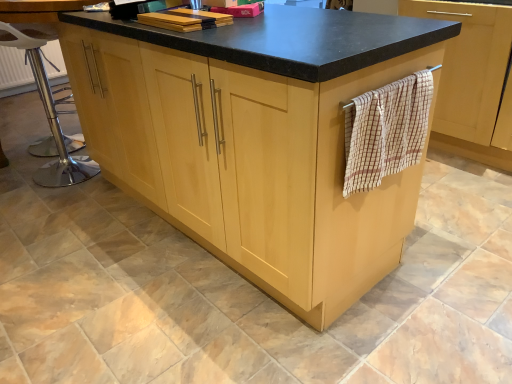
Image resolution: width=512 pixels, height=384 pixels. What do you see at coordinates (185, 19) in the screenshot?
I see `wooden cutting board at upper center` at bounding box center [185, 19].

The height and width of the screenshot is (384, 512). What are the coordinates of `beige checkered towel at right` in the screenshot? It's located at (386, 131).

The height and width of the screenshot is (384, 512). Describe the element at coordinates (256, 140) in the screenshot. I see `light wood cupboard at center` at that location.

Locate an element on the screen. This screenshot has height=384, width=512. polished chrome bar stool at left is located at coordinates (49, 117).

From a real-world perspective, which object rests below the other?

wooden towel rack at right, from a real-world perspective.

Is wooden towel rack at right oriented towards polished chrome bar stool at left?

No, wooden towel rack at right is not aimed at polished chrome bar stool at left.

Is the position of wooden towel rack at right less distant than that of polished chrome bar stool at left?

Yes, wooden towel rack at right is in front of polished chrome bar stool at left.

Find the location of a particular element. bar stool lying below the wooden towel rack at right (from the image's perspective) is located at coordinates (49, 117).

Is beige checkered towel at right completely or partially outside of wooden cutting board at upper center?

Yes, beige checkered towel at right is located beyond the bounds of wooden cutting board at upper center.

Considering the sizes of objects beige checkered towel at right and wooden cutting board at upper center in the image provided, who is shorter, beige checkered towel at right or wooden cutting board at upper center?

Standing shorter between the two is wooden cutting board at upper center.

Considering the points (391, 110) and (169, 17), which point is in front, point (391, 110) or point (169, 17)?

Point (391, 110)

Does wooden cutting board at upper center touch wooden towel rack at right?

There is a gap between wooden cutting board at upper center and wooden towel rack at right.

Is wooden cutting board at upper center to the left of wooden towel rack at right from the viewer's perspective?

Indeed, wooden cutting board at upper center is positioned on the left side of wooden towel rack at right.

Is point (172, 22) closer or farther from the camera than point (450, 106)?

Point (172, 22).

Is wooden cutting board at upper center wider than wooden towel rack at right?

No.

Is polished chrome bar stool at left not within beige checkered towel at right?

Absolutely, polished chrome bar stool at left is external to beige checkered towel at right.

Does polished chrome bar stool at left have a smaller size compared to beige checkered towel at right?

No.

From a real-world perspective, is polished chrome bar stool at left located higher than beige checkered towel at right?

No.

Would you say polished chrome bar stool at left is to the left or to the right of beige checkered towel at right in the picture?

Clearly, polished chrome bar stool at left is on the left of beige checkered towel at right in the image.

Find the location of a particular element. book on the right of the polished chrome bar stool at left is located at coordinates (185, 19).

Can you tell me how much polished chrome bar stool at left and wooden cutting board at upper center differ in facing direction?

67.7 degrees separate the facing orientations of polished chrome bar stool at left and wooden cutting board at upper center.

From the image's perspective, would you say polished chrome bar stool at left is positioned over wooden cutting board at upper center?

No, from the image's perspective, polished chrome bar stool at left is not above wooden cutting board at upper center.

Is polished chrome bar stool at left outside of wooden cutting board at upper center?

Result: Yes, polished chrome bar stool at left is located beyond the bounds of wooden cutting board at upper center.

Is beige checkered towel at right at the back of wooden cutting board at upper center?

No.

Considering the relative sizes of wooden cutting board at upper center and beige checkered towel at right in the image provided, is wooden cutting board at upper center bigger than beige checkered towel at right?

Incorrect, wooden cutting board at upper center is not larger than beige checkered towel at right.

Locate an element on the screen. The height and width of the screenshot is (384, 512). book that is on the left side of beige checkered towel at right is located at coordinates (185, 19).

Is point (229, 24) closer to viewer compared to point (361, 144)?

No, it is behind (361, 144).

Between wooden cutting board at upper center and light wood cupboard at center, which one has larger size?

With larger size is light wood cupboard at center.

Does wooden cutting board at upper center have a greater width compared to light wood cupboard at center?

No.

From the picture: Would you consider wooden cutting board at upper center to be distant from light wood cupboard at center?

No, there isn't a large distance between wooden cutting board at upper center and light wood cupboard at center.

Is wooden cutting board at upper center spatially inside light wood cupboard at center, or outside of it?

wooden cutting board at upper center is located inside light wood cupboard at center.

Where is `cabinetry lying above the polished chrome bar stool at left (from the image's perspective)`? cabinetry lying above the polished chrome bar stool at left (from the image's perspective) is located at coordinates (470, 78).

At what (x,y) coordinates should I click in order to perform the action: click on book behind the beige checkered towel at right. Please return your answer as a coordinate pair (x, y). The height and width of the screenshot is (384, 512). Looking at the image, I should click on (185, 19).

Consider the image. Looking at the image, which one is located further to polished chrome bar stool at left, light wood cupboard at center or wooden cutting board at upper center?

Among the two, light wood cupboard at center is located further to polished chrome bar stool at left.

Looking at the image, which one is located further to polished chrome bar stool at left, wooden cutting board at upper center or wooden towel rack at right?

wooden towel rack at right is further to polished chrome bar stool at left.

Considering their positions, is wooden towel rack at right positioned further to wooden cutting board at upper center than beige checkered towel at right?

Based on the image, wooden towel rack at right appears to be further to wooden cutting board at upper center.

From the image, which object appears to be farther from polished chrome bar stool at left, light wood cupboard at center or wooden towel rack at right?

wooden towel rack at right.

Looking at the image, which one is located further to light wood cupboard at center, wooden cutting board at upper center or polished chrome bar stool at left?

polished chrome bar stool at left is further to light wood cupboard at center.

From the image, which object appears to be farther from light wood cupboard at center, beige checkered towel at right or polished chrome bar stool at left?

polished chrome bar stool at left is further to light wood cupboard at center.

When comparing their distances from polished chrome bar stool at left, does beige checkered towel at right or light wood cupboard at center seem closer?

light wood cupboard at center lies closer to polished chrome bar stool at left than the other object.

Which object lies nearer to the anchor point light wood cupboard at center, polished chrome bar stool at left or wooden towel rack at right?

The object closer to light wood cupboard at center is polished chrome bar stool at left.

You are a GUI agent. You are given a task and a screenshot of the screen. Output one action in this format:
    pyautogui.click(x=<x>, y=<y>)
    Task: Click on the book between polished chrome bar stool at left and wooden towel rack at right in the horizontal direction
    This screenshot has width=512, height=384.
    Given the screenshot: What is the action you would take?
    pyautogui.click(x=185, y=19)

The width and height of the screenshot is (512, 384). Find the location of `cupboard between polished chrome bar stool at left and beige checkered towel at right from left to right`. cupboard between polished chrome bar stool at left and beige checkered towel at right from left to right is located at coordinates (256, 140).

Find the location of a particular element. The height and width of the screenshot is (384, 512). book located between polished chrome bar stool at left and light wood cupboard at center in the left-right direction is located at coordinates (185, 19).

Locate an element on the screen. The image size is (512, 384). bath towel located between wooden cutting board at upper center and wooden towel rack at right in the left-right direction is located at coordinates pos(386,131).